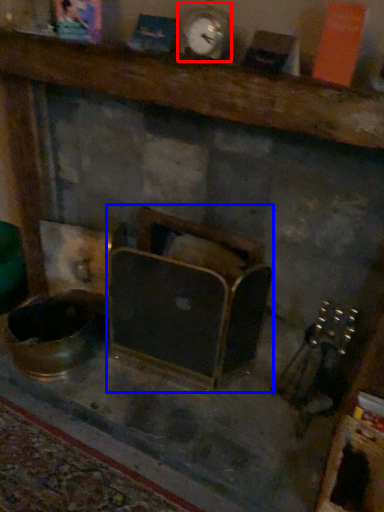
Question: Which object is closer to the camera taking this photo, clock (highlighted by a red box) or furniture (highlighted by a blue box)?

Choices:
 (A) clock
 (B) furniture

Answer: (A)